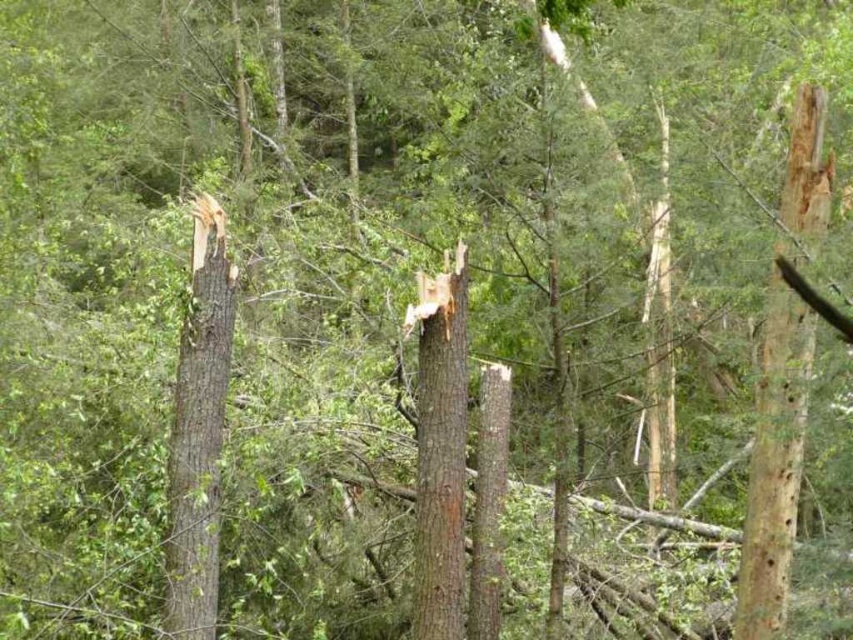
From the picture: You are a park ranger assessing storm damage. You see a point marked at coordinates [198,429]. What does this point indicate?

The point at coordinates [198,429] indicates a smooth brown tree trunk at left.

You are a park ranger trying to locate the smooth brown tree trunk at left in the forest scene. According to the coordinates provided, where exactly should you look to find it?

The smooth brown tree trunk at left is located at point coordinates of (198, 429).